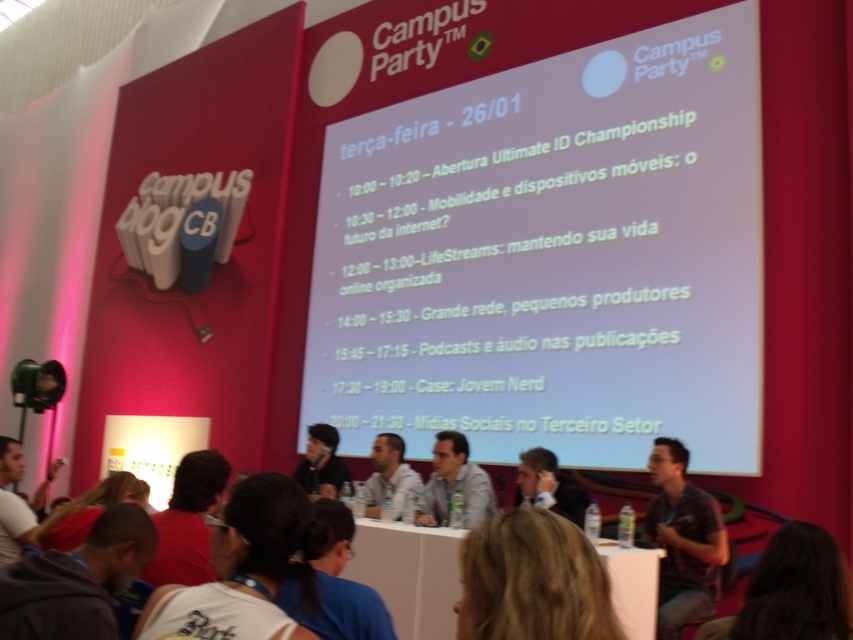
Between dark brown hair at lower left and light gray shirt at center, which one appears on the right side from the viewer's perspective?

light gray shirt at center

Does point (202, 477) come behind point (399, 452)?

That is False.

This screenshot has height=640, width=853. In order to click on dark brown hair at lower left in this screenshot , I will do `click(189, 520)`.

Locate an element on the screen. The image size is (853, 640). dark brown hair at lower left is located at coordinates (189, 520).

Looking at this image, who is taller, striped denim shirt at right or black matte shirt at center?

Standing taller between the two is striped denim shirt at right.

Is striped denim shirt at right thinner than black matte shirt at center?

Yes, striped denim shirt at right is thinner than black matte shirt at center.

Does point (722, 548) come behind point (338, 440)?

That is False.

Find the location of a particular element. The height and width of the screenshot is (640, 853). striped denim shirt at right is located at coordinates (683, 540).

Is white fabric shirt at lower center closer to the viewer compared to blonde hair at center?

Result: No.

This screenshot has height=640, width=853. Find the location of `white fabric shirt at lower center`. white fabric shirt at lower center is located at coordinates (244, 568).